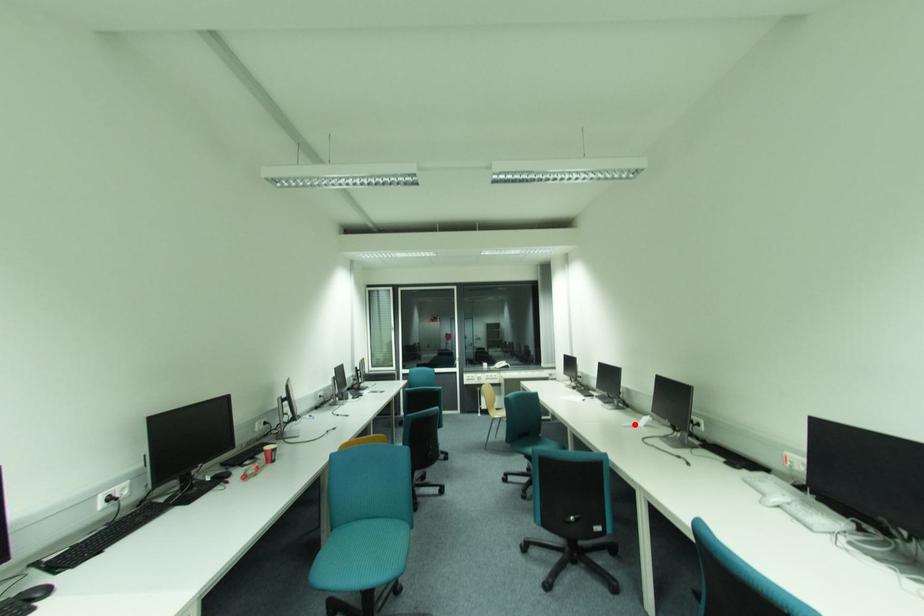
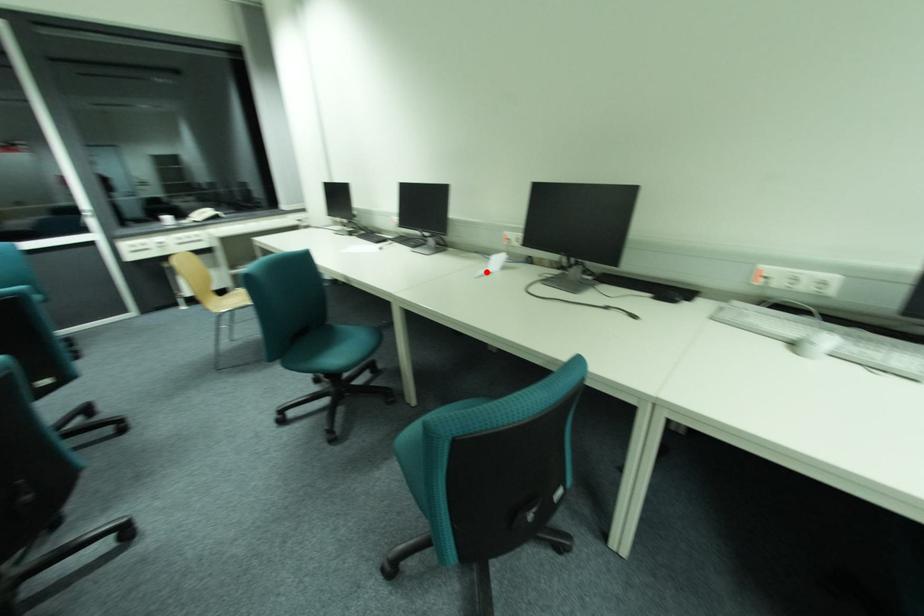
In the scene shown: I am providing you with two images of the same scene from different viewpoints. A red point is marked on the first image and another point is marked on the second image. Is the marked point in image1 the same physical position as the marked point in image2?

Yes